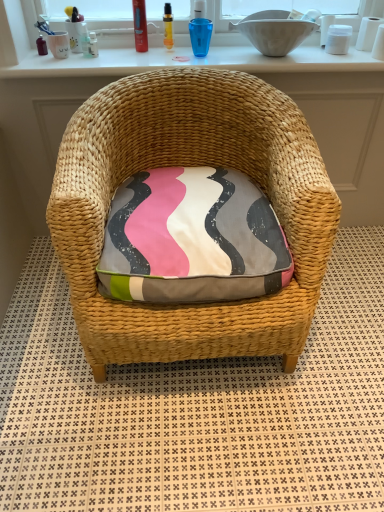
Identify the location of blank space situated above white glossy window sill at upper center (from a real-world perspective). (192, 55).